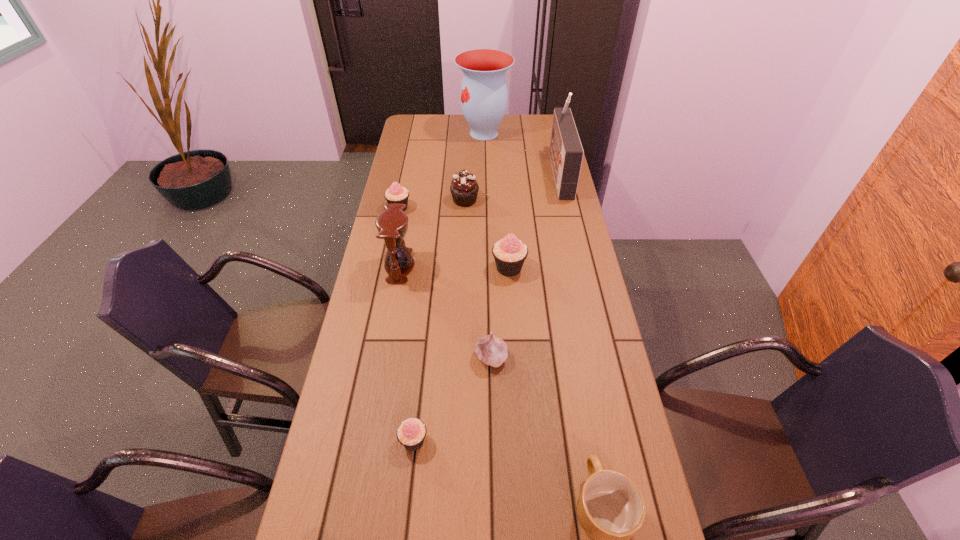
Find the location of a particular element. The width and height of the screenshot is (960, 540). the third nearest object is located at coordinates (491, 350).

This screenshot has width=960, height=540. In order to click on white garlic in this screenshot , I will do `click(491, 350)`.

Locate an element on the screen. The image size is (960, 540). the shortest cupcake is located at coordinates (411, 433).

At what (x,y) coordinates should I click in order to perform the action: click on the smallest pink cupcake. Please return your answer as a coordinate pair (x, y). This screenshot has width=960, height=540. Looking at the image, I should click on (411, 433).

Locate an element on the screen. Image resolution: width=960 pixels, height=540 pixels. free space located 0.150m on the left of the farthest object is located at coordinates tap(426, 133).

Where is `blank space located on the front panel of the radio receiver`? blank space located on the front panel of the radio receiver is located at coordinates (529, 172).

The height and width of the screenshot is (540, 960). Find the location of `free space located on the front panel of the radio receiver`. free space located on the front panel of the radio receiver is located at coordinates (463, 172).

Where is `vacant space positioned on the front panel of the radio receiver`? vacant space positioned on the front panel of the radio receiver is located at coordinates (478, 172).

At what (x,y) coordinates should I click in order to perform the action: click on vacant space located 0.060m on the right of the brown hourglass. Please return your answer as a coordinate pair (x, y). Looking at the image, I should click on (432, 266).

Locate an element on the screen. free location located 0.090m on the back of the rightmost pink cupcake is located at coordinates (507, 239).